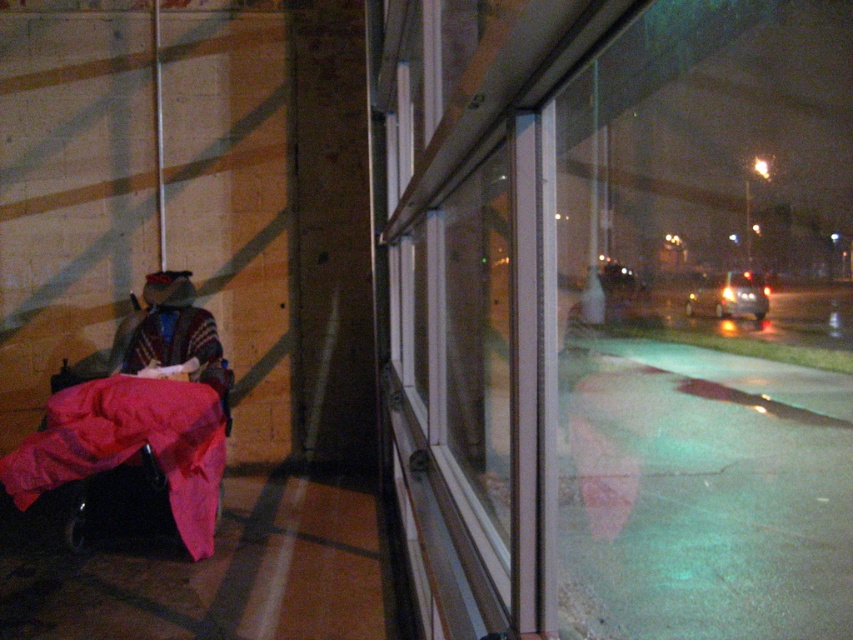
You are a delivery robot with a 3.5 meter long package that needs to be placed between the transparent glass window at center and the velvet red blanket at lower left. Can the package fit in the space between them?

The transparent glass window at center and velvet red blanket at lower left are 5.69 meters apart from each other. Since the package is 3.5 meters long, it can fit in the space between them as the distance is greater than the package length.

You are standing inside a building and looking through the transparent glass window at center. There is a velvet red blanket at lower left nearby. Which object is closer to your right side?

The transparent glass window at center is positioned on the right side of the velvet red blanket at lower left, so it is closer to your right side.